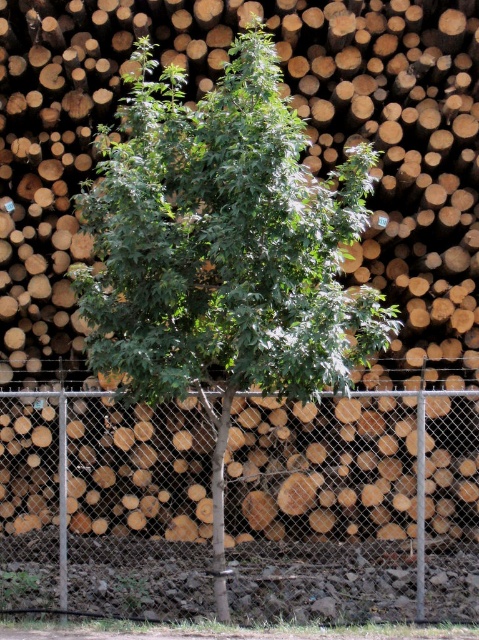
Between green leafy tree at center and green matte tree trunk at center, which one has less height?

green matte tree trunk at center is shorter.

Is green leafy tree at center to the left of green matte tree trunk at center from the viewer's perspective?

Incorrect, green leafy tree at center is not on the left side of green matte tree trunk at center.

Describe the element at coordinates (224, 243) in the screenshot. Image resolution: width=479 pixels, height=640 pixels. I see `green leafy tree at center` at that location.

Find the location of a particular element. This screenshot has width=479, height=640. green leafy tree at center is located at coordinates (224, 243).

Which is behind, point (136, 502) or point (214, 461)?

The point (136, 502) is more distant.

Does metal chain-link fence at center lie in front of green matte tree trunk at center?

No, it is not.

Which is in front, point (202, 442) or point (223, 420)?

Point (223, 420) is in front.

Locate an element on the screen. The height and width of the screenshot is (640, 479). metal chain-link fence at center is located at coordinates (354, 504).

Which of these two, metal chain-link fence at center or green leafy tree at center, stands taller?

With more height is green leafy tree at center.

Between metal chain-link fence at center and green leafy tree at center, which one appears on the left side from the viewer's perspective?

Positioned to the left is green leafy tree at center.

You are a GUI agent. You are given a task and a screenshot of the screen. Output one action in this format:
    pyautogui.click(x=<x>, y=<y>)
    Task: Click on the metal chain-link fence at center
    The image size is (479, 640).
    Given the screenshot: What is the action you would take?
    pyautogui.click(x=354, y=504)